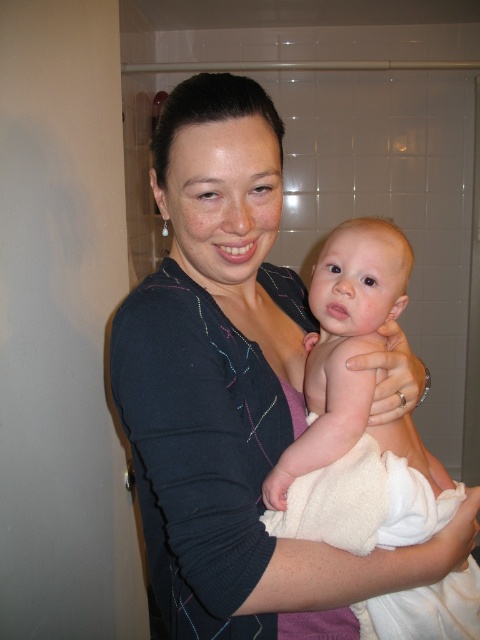
Between matte black sweater at center and white towel wrapped baby at center, which one is positioned higher?

matte black sweater at center is higher up.

Who is more distant from viewer, (136, 476) or (331, 470)?

The point (136, 476) is more distant.

Which is in front, point (299, 554) or point (352, 394)?

Positioned in front is point (299, 554).

Identify the location of matte black sweater at center. (232, 390).